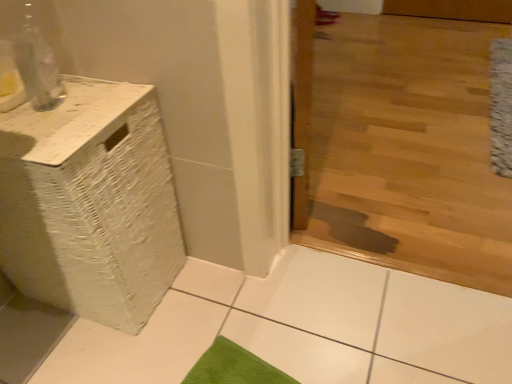
Measure the distance between white woven basket at left and camera.

white woven basket at left is 29.68 inches from camera.

Locate an element on the screen. Image resolution: width=512 pixels, height=384 pixels. white woven basket at left is located at coordinates (90, 203).

What do you see at coordinates (90, 203) in the screenshot? I see `white woven basket at left` at bounding box center [90, 203].

What is the approximate height of white textured mat at right?

white textured mat at right is 3.45 inches tall.

You are a GUI agent. You are given a task and a screenshot of the screen. Output one action in this format:
    pyautogui.click(x=<x>, y=<y>)
    Task: Click on the white textured mat at right
    The image size is (512, 384).
    Given the screenshot: What is the action you would take?
    pyautogui.click(x=501, y=107)

Describe the element at coordinates (501, 107) in the screenshot. I see `white textured mat at right` at that location.

Where is `white woven basket at left`? The image size is (512, 384). white woven basket at left is located at coordinates (90, 203).

Between white textured mat at right and white woven basket at left, which one appears on the right side from the viewer's perspective?

white textured mat at right.

Is white textured mat at right further to camera compared to white woven basket at left?

Yes, white textured mat at right is further from the camera.

Is point (510, 78) positioned after point (120, 139)?

Yes.

From the image's perspective, is white textured mat at right beneath white woven basket at left?

Incorrect, from the image's perspective, white textured mat at right is higher than white woven basket at left.

From a real-world perspective, is white textured mat at right on top of white woven basket at left?

No.

Looking at this image, which of these two, white textured mat at right or white woven basket at left, is wider?

white textured mat at right is wider.

From their relative heights in the image, would you say white textured mat at right is taller or shorter than white woven basket at left?

In the image, white textured mat at right appears to be shorter than white woven basket at left.

Between white textured mat at right and white woven basket at left, which one has smaller size?

With smaller size is white textured mat at right.

Which is correct: white textured mat at right is inside white woven basket at left, or outside of it?

white textured mat at right lies outside white woven basket at left.

Does white textured mat at right touch white woven basket at left?

white textured mat at right and white woven basket at left are clearly separated.

Is white textured mat at right facing away from white woven basket at left?

No, white woven basket at left is not at the back of white textured mat at right.

How much distance is there between white textured mat at right and white woven basket at left?

A distance of 4.65 feet exists between white textured mat at right and white woven basket at left.

The image size is (512, 384). I want to click on mat above the white woven basket at left (from the image's perspective), so (x=501, y=107).

Is white woven basket at left at the left side of white textured mat at right?

Indeed, white woven basket at left is positioned on the left side of white textured mat at right.

Considering their positions, is white woven basket at left located in front of or behind white textured mat at right?

In the image, white woven basket at left appears in front of white textured mat at right.

Is point (162, 215) positioned before point (497, 140)?

Yes, it is.

From the image's perspective, which is below, white woven basket at left or white textured mat at right?

From the image's view, white woven basket at left is below.

From a real-world perspective, which is physically below, white woven basket at left or white textured mat at right?

white textured mat at right is physically lower.

In terms of width, does white woven basket at left look wider or thinner when compared to white textured mat at right?

In the image, white woven basket at left appears to be more narrow than white textured mat at right.

Between white woven basket at left and white textured mat at right, which one has less height?

With less height is white textured mat at right.

Is white woven basket at left smaller than white textured mat at right?

Actually, white woven basket at left might be larger than white textured mat at right.

Do you think white woven basket at left is within white textured mat at right, or outside of it?

white woven basket at left is located beyond the bounds of white textured mat at right.

Is white woven basket at left not near white textured mat at right?

Yes, white woven basket at left is far from white textured mat at right.

Is white woven basket at left oriented towards white textured mat at right?

No, white woven basket at left is not oriented towards white textured mat at right.

How much distance is there between white woven basket at left and white textured mat at right?

white woven basket at left is 4.65 feet from white textured mat at right.

At what (x,y) coordinates should I click in order to perform the action: click on furniture on the left of white textured mat at right. Please return your answer as a coordinate pair (x, y). Image resolution: width=512 pixels, height=384 pixels. Looking at the image, I should click on (90, 203).

Image resolution: width=512 pixels, height=384 pixels. Identify the location of furniture above the white textured mat at right (from a real-world perspective). pyautogui.click(x=90, y=203).

At what (x,y) coordinates should I click in order to perform the action: click on mat behind the white woven basket at left. Please return your answer as a coordinate pair (x, y). The height and width of the screenshot is (384, 512). Looking at the image, I should click on (501, 107).